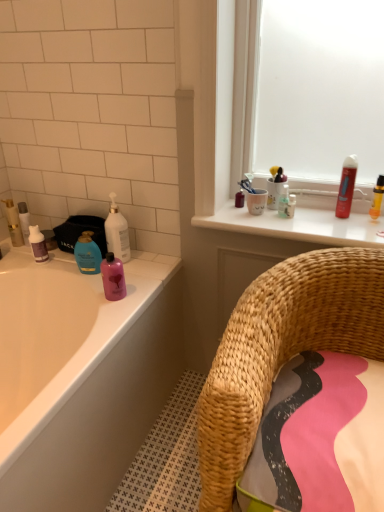
In order to click on vacant area that lies between translucent yellow bottle at upper right, positioned as the first toiletry in right-to-left order, and translucent plastic toothbrush at upper center, which appears as the 4th toiletry when viewed from the left in this screenshot , I will do `click(321, 220)`.